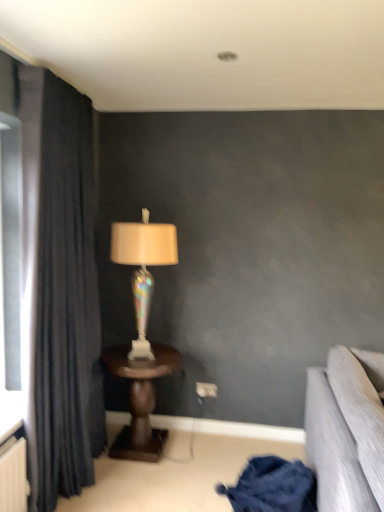
Find the location of a particular element. dark fabric curtain at left is located at coordinates (59, 290).

What do you see at coordinates (143, 268) in the screenshot?
I see `iridescent glass lamp at center` at bounding box center [143, 268].

Find the location of a particular element. The width and height of the screenshot is (384, 512). wooden table at center is located at coordinates (141, 400).

Find the location of a particular element. dark fabric curtain at left is located at coordinates (59, 290).

Considering the positions of points (299, 468) and (103, 359), is point (299, 468) closer to camera compared to point (103, 359)?

Yes, point (299, 468) is closer to viewer.

From a real-world perspective, which object rests below the other?

dark blue fabric at lower right.

Looking at the image, does dark blue fabric at lower right seem bigger or smaller compared to wooden table at center?

dark blue fabric at lower right is smaller than wooden table at center.

From a real-world perspective, is dark fabric curtain at left on dark blue fabric at lower right?

Yes.

Based on the photo, looking at their sizes, would you say dark fabric curtain at left is wider or thinner than dark blue fabric at lower right?

In the image, dark fabric curtain at left appears to be more narrow than dark blue fabric at lower right.

Find the location of a particular element. This screenshot has width=384, height=512. curtain in front of the dark blue fabric at lower right is located at coordinates (59, 290).

How much distance is there between dark fabric curtain at left and dark blue fabric at lower right?

1.25 meters.

From the picture: Is the surface of wooden table at center in direct contact with iridescent glass lamp at center?

There is a gap between wooden table at center and iridescent glass lamp at center.

Is wooden table at center positioned with its back to iridescent glass lamp at center?

No, wooden table at center is not facing away from iridescent glass lamp at center.

Is wooden table at center wider than iridescent glass lamp at center?

Indeed, wooden table at center has a greater width compared to iridescent glass lamp at center.

Based on the photo, is iridescent glass lamp at center aimed at dark fabric curtain at left?

No.

Based on the photo, which object is thinner, iridescent glass lamp at center or dark fabric curtain at left?

Thinner between the two is dark fabric curtain at left.

Considering the positions of objects iridescent glass lamp at center and dark fabric curtain at left in the image provided, who is behind, iridescent glass lamp at center or dark fabric curtain at left?

iridescent glass lamp at center is further away from the camera.

Is dark blue fabric at lower right oriented towards dark fabric curtain at left?

No, dark blue fabric at lower right is not oriented towards dark fabric curtain at left.

Can you confirm if dark blue fabric at lower right is taller than dark fabric curtain at left?

No.

Consider the image. Does dark blue fabric at lower right have a greater width compared to dark fabric curtain at left?

Yes.

Is dark blue fabric at lower right to the right of dark fabric curtain at left from the viewer's perspective?

Yes.

Where is `table located on the left of dark blue fabric at lower right`? table located on the left of dark blue fabric at lower right is located at coordinates (141, 400).

How much distance is there between wooden table at center and dark blue fabric at lower right?

31.19 inches.

Considering the sizes of objects wooden table at center and dark blue fabric at lower right in the image provided, who is taller, wooden table at center or dark blue fabric at lower right?

wooden table at center is taller.

From a real-world perspective, who is located higher, wooden table at center or dark fabric curtain at left?

dark fabric curtain at left is physically above.

Between wooden table at center and dark fabric curtain at left, which one has smaller size?

wooden table at center.

Is wooden table at center touching dark fabric curtain at left?

No.

Which of these two, wooden table at center or dark fabric curtain at left, stands shorter?

wooden table at center.

Image resolution: width=384 pixels, height=512 pixels. I want to click on table behind the dark blue fabric at lower right, so click(x=141, y=400).

Where is `curtain above the dark blue fabric at lower right (from a real-world perspective)`? This screenshot has height=512, width=384. curtain above the dark blue fabric at lower right (from a real-world perspective) is located at coordinates (59, 290).

Considering their positions, is iridescent glass lamp at center positioned further to dark blue fabric at lower right than dark fabric curtain at left?

Result: dark fabric curtain at left.

From the image, which object appears to be farther from wooden table at center, iridescent glass lamp at center or dark blue fabric at lower right?

Among the two, dark blue fabric at lower right is located further to wooden table at center.

Estimate the real-world distances between objects in this image. Which object is closer to iridescent glass lamp at center, wooden table at center or dark fabric curtain at left?

wooden table at center.

Which object lies nearer to the anchor point wooden table at center, dark blue fabric at lower right or dark fabric curtain at left?

Among the two, dark fabric curtain at left is located nearer to wooden table at center.

Based on their spatial positions, is dark blue fabric at lower right or dark fabric curtain at left further from iridescent glass lamp at center?

Based on the image, dark blue fabric at lower right appears to be further to iridescent glass lamp at center.

Considering their positions, is iridescent glass lamp at center positioned further to dark fabric curtain at left than dark blue fabric at lower right?

Based on the image, dark blue fabric at lower right appears to be further to dark fabric curtain at left.

Considering their positions, is dark fabric curtain at left positioned further to dark blue fabric at lower right than iridescent glass lamp at center?

dark fabric curtain at left is further to dark blue fabric at lower right.

Estimate the real-world distances between objects in this image. Which object is closer to dark fabric curtain at left, wooden table at center or iridescent glass lamp at center?

The object closer to dark fabric curtain at left is iridescent glass lamp at center.

Identify the location of table between iridescent glass lamp at center and dark blue fabric at lower right vertically. The height and width of the screenshot is (512, 384). (141, 400).

Identify the location of table between dark fabric curtain at left and dark blue fabric at lower right from top to bottom. This screenshot has width=384, height=512. (141, 400).

The image size is (384, 512). I want to click on curtain that lies between iridescent glass lamp at center and wooden table at center from top to bottom, so click(x=59, y=290).

Locate an element on the screen. The image size is (384, 512). curtain between iridescent glass lamp at center and dark blue fabric at lower right vertically is located at coordinates (59, 290).